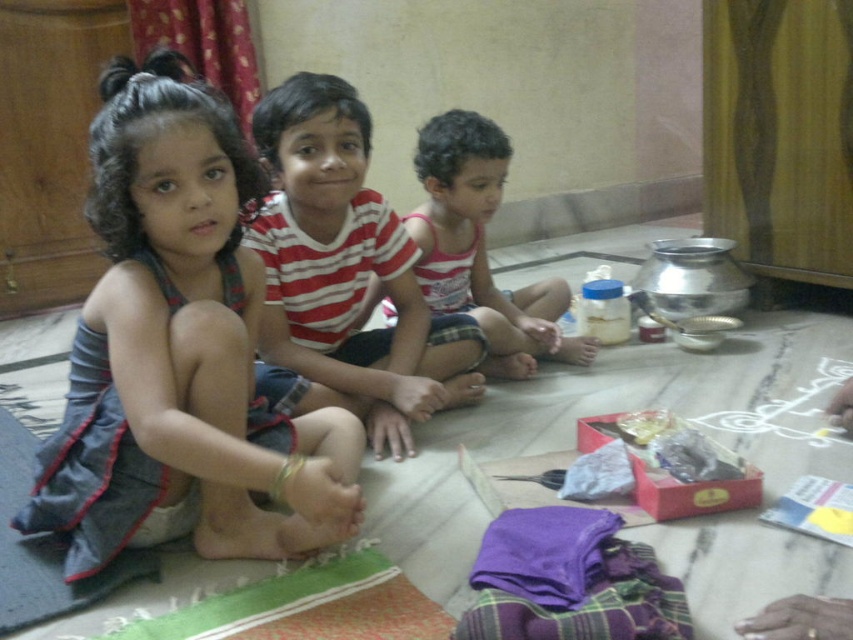
You are a photographer setting up for a family photo. You need to ensure that the striped cotton shirt at center and the dark grey fabric mat at lower left are both visible in the frame. Given their sizes, which object should you prioritize positioning closer to the camera to maintain clarity?

The striped cotton shirt at center is narrower than the dark grey fabric mat at lower left. To maintain clarity, prioritize positioning the striped cotton shirt at center closer to the camera since smaller objects may require closer framing to ensure details are visible.

You are a photographer taking a picture of the two children at the center. The denim skirt at center and the matte pink tank top at center are both in the frame. Which clothing item is on the left side?

The denim skirt at center is positioned on the left side of the matte pink tank top at center.